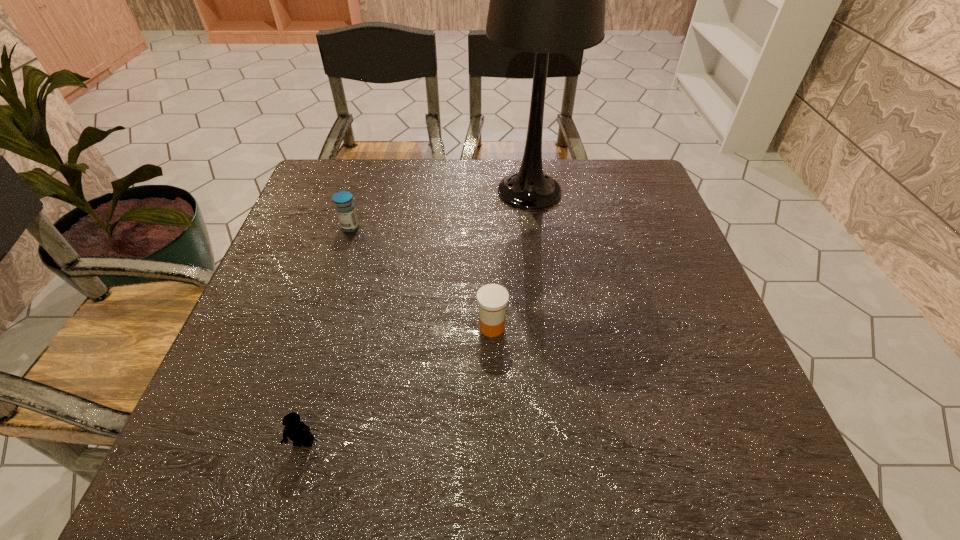
Locate an element on the screen. The height and width of the screenshot is (540, 960). free space between the tallest object and the second farthest object is located at coordinates (440, 210).

Locate an element on the screen. vacant space that is in between the tallest object and the left medicine is located at coordinates (440, 210).

You are a GUI agent. You are given a task and a screenshot of the screen. Output one action in this format:
    pyautogui.click(x=<x>, y=<y>)
    Task: Click on the vacant point located between the nearest object and the tallest object
    Image resolution: width=960 pixels, height=540 pixels.
    Given the screenshot: What is the action you would take?
    pyautogui.click(x=417, y=317)

Where is `object that is the closest to the nearest object`? This screenshot has width=960, height=540. object that is the closest to the nearest object is located at coordinates (492, 298).

Locate which object ranks second in proximity to the shortest object. Please provide its 2D coordinates. Your answer should be formatted as a tuple, i.e. [(x, y)], where the tuple contains the x and y coordinates of a point satisfying the conditions above.

[(345, 208)]

Identify the location of blank area in the image that satisfies the following two spatial constraints: 1. on the label of the right medicine; 2. on the front-facing side of the Lego. The width and height of the screenshot is (960, 540). (494, 443).